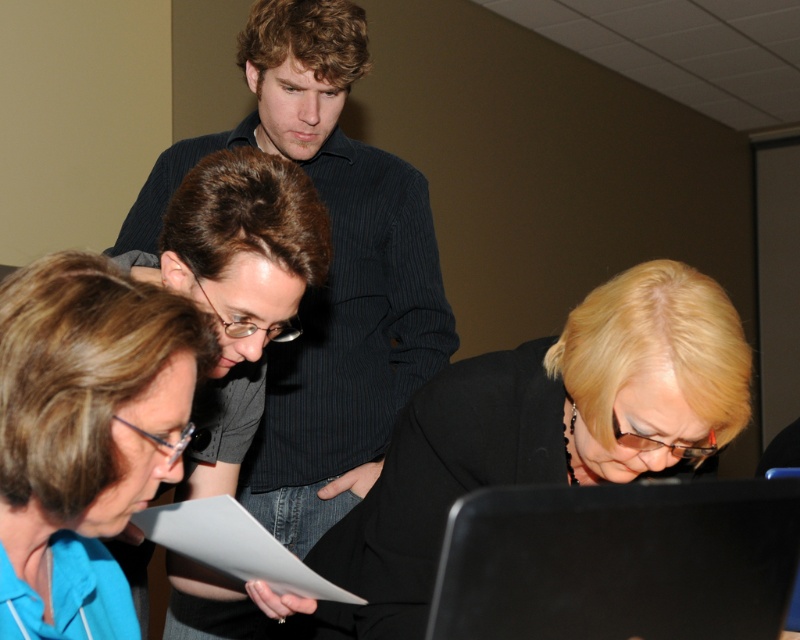
Question: Can you confirm if blue fabric shirt at lower left is positioned to the right of black matte laptop at lower right?

Choices:
 (A) yes
 (B) no

Answer: (B)

Question: Can you confirm if blue fabric shirt at lower left is wider than white paper at lower center?

Choices:
 (A) yes
 (B) no

Answer: (B)

Question: Is blue fabric shirt at lower left to the left of white paper at lower center from the viewer's perspective?

Choices:
 (A) yes
 (B) no

Answer: (A)

Question: Which object is farther from the camera taking this photo?

Choices:
 (A) black matte laptop at lower right
 (B) white paper at lower center

Answer: (B)

Question: Among these points, which one is farthest from the camera?

Choices:
 (A) (686, 618)
 (B) (640, 372)
 (C) (29, 301)

Answer: (B)

Question: Which object is positioned farthest from the blue fabric shirt at lower left?

Choices:
 (A) black matte jacket at lower center
 (B) black matte laptop at lower right
 (C) dark blue striped shirt at upper center
 (D) white paper at lower center

Answer: (C)